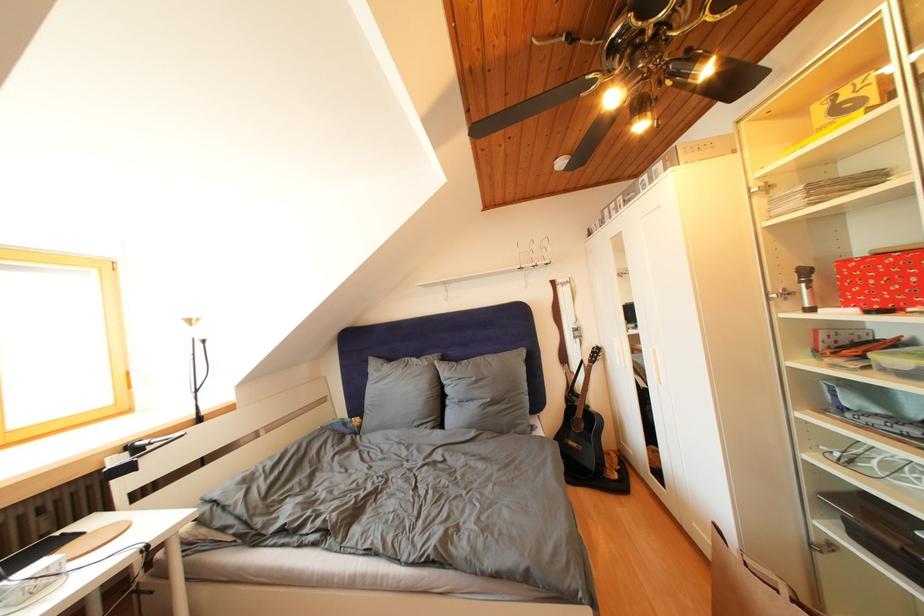
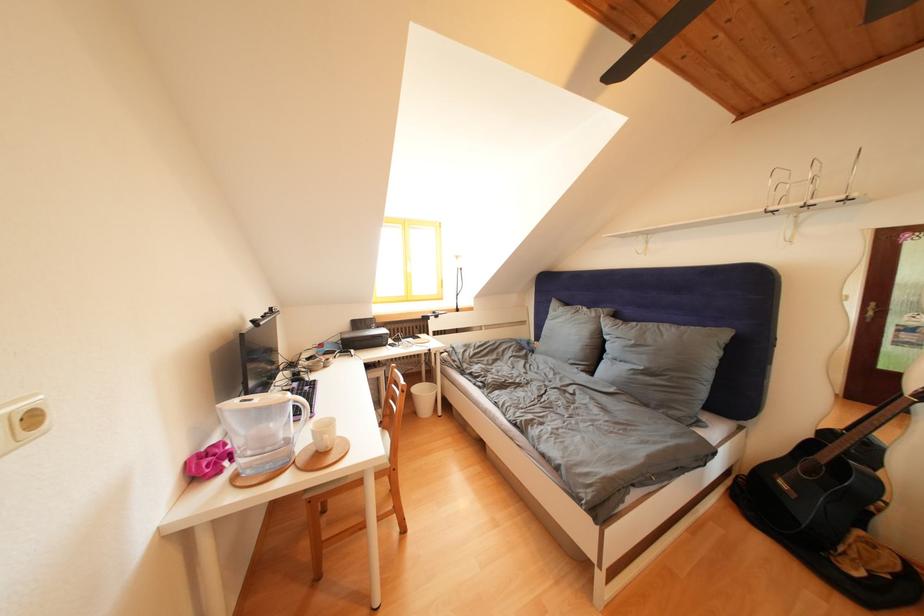
Question: I am providing you with two images of the same scene from different viewpoints. After the viewpoint changes to image2, which objects are now occluded?

Choices:
 (A) black webcam
 (B) grey pillow
 (C) pink glasses case
 (D) none of these

Answer: (D)